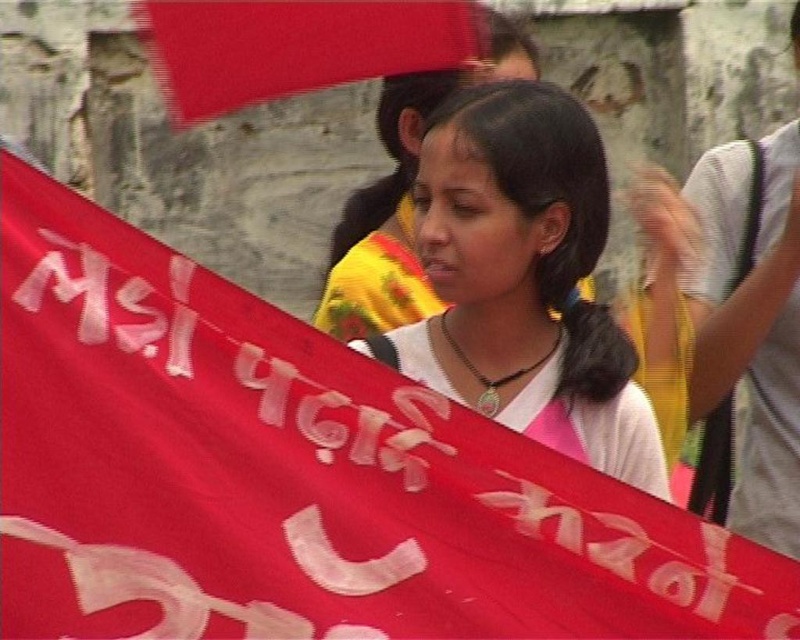
You are a photographer trying to capture a clear shot of the white matte shirt at center and the matte white shirt at center in the crowd. Which one is taller and would be more visible from your current position?

The white matte shirt at center is much taller than the matte white shirt at center, so it would be more visible from your current position.

You are a photographer at the event and want to capture a photo that includes both the white matte shirt at center and the matte red flag at upper center. Based on their positions, which object should be placed on the left side of the photo to ensure both are visible?

The matte red flag at upper center should be placed on the left side of the photo since the white matte shirt at center is to the right of it, ensuring both are visible in the frame.

You are standing at the origin point in the image. Can you tell me the 2D coordinates of the white matte shirt at center?

The white matte shirt at center is located at coordinates (524, 280).